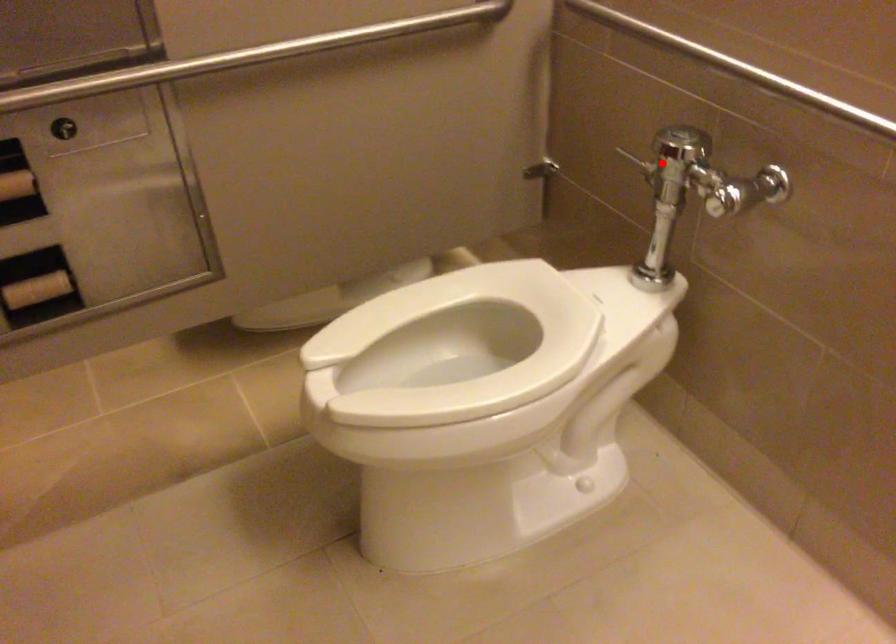
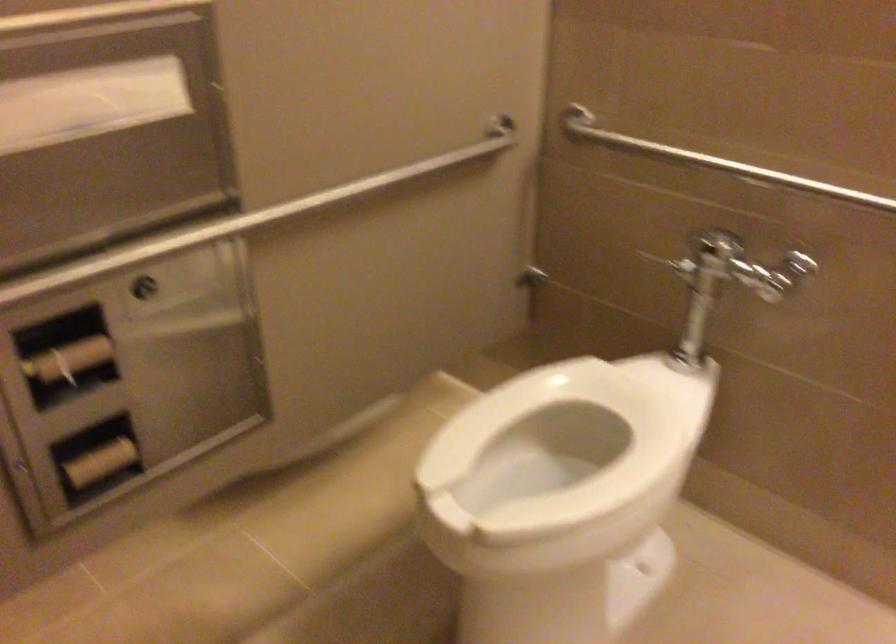
The point at the highlighted location is marked in the first image. Where is the corresponding point in the second image?

(703, 260)